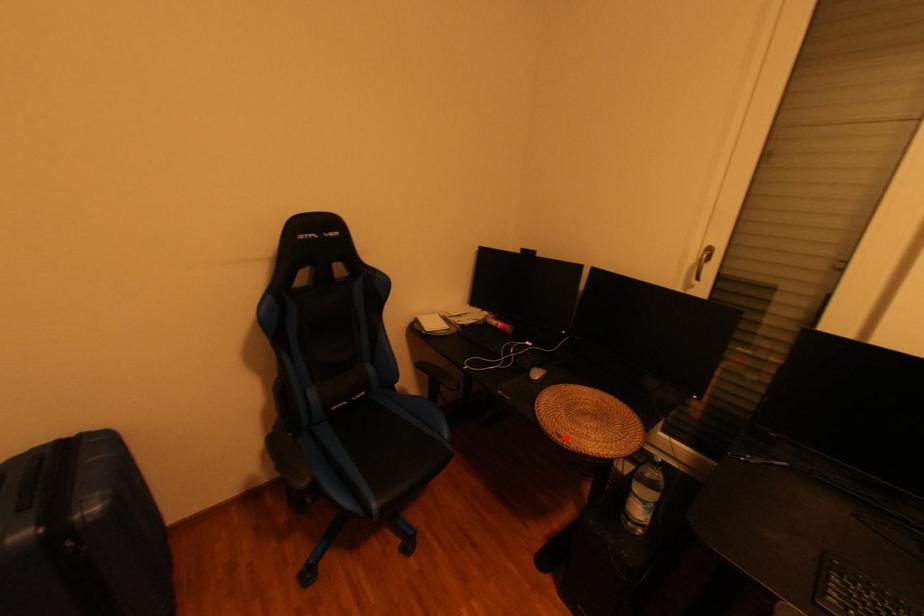
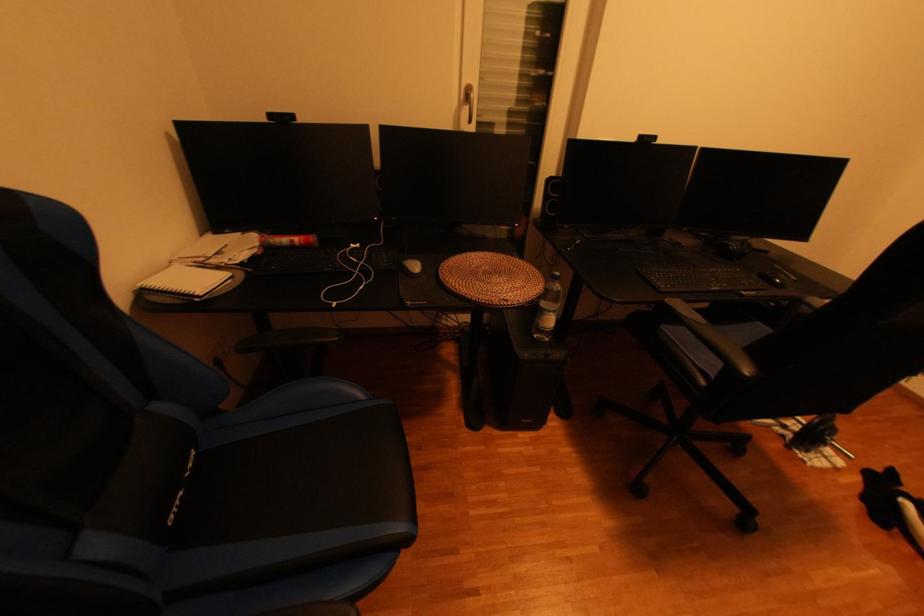
Find the pixel in the second image that matches the highlighted location in the first image.

(515, 304)